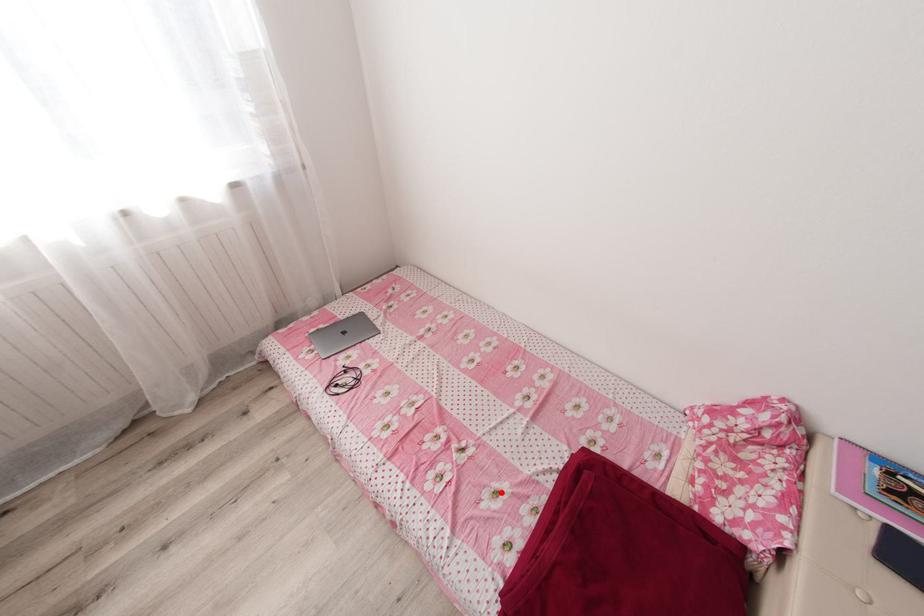
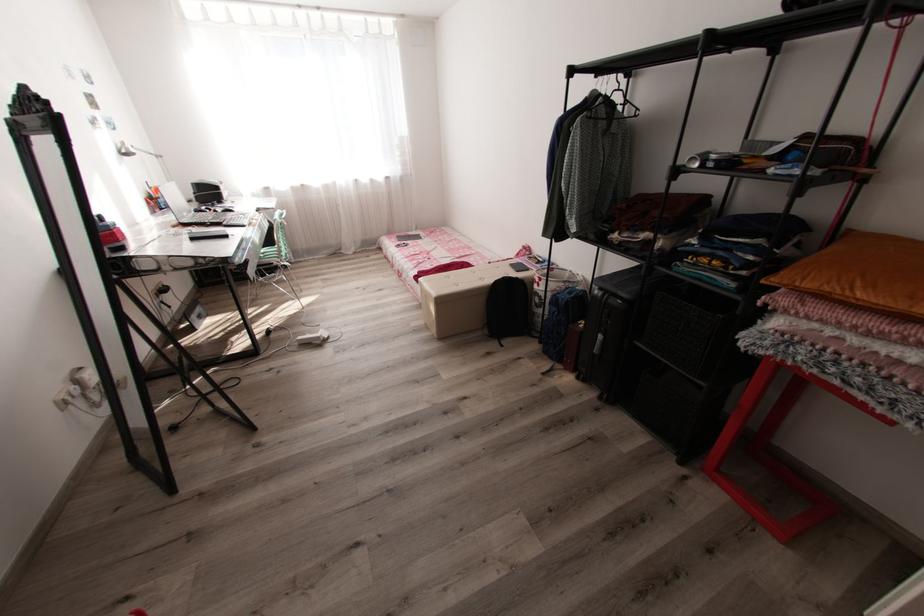
The point at the highlighted location is marked in the first image. Where is the corresponding point in the second image?

(436, 265)